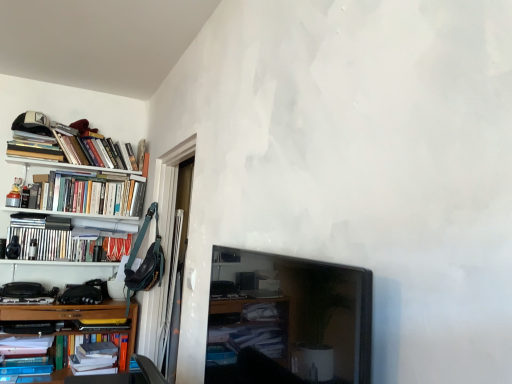
Question: Is hardcover books at left, the first book in the top-to-bottom sequence, situated inside matte black tv at center or outside?

Choices:
 (A) inside
 (B) outside

Answer: (B)

Question: From their relative heights in the image, would you say hardcover books at left, which appears as the seventh book when ordered from the bottom, is taller or shorter than matte black tv at center?

Choices:
 (A) tall
 (B) short

Answer: (B)

Question: Estimate the real-world distances between objects in this image. Which object is closer to the matte black tv at center?

Choices:
 (A) hardcover books at left, which appears as the fourth book when ordered from the bottom
 (B) hardcover book at lower left, acting as the sixth book starting from the top
 (C) hardcover books at left, marked as the 5th book in a top-to-bottom arrangement
 (D) hardcover books at left, the first book in the top-to-bottom sequence
 (E) hardcover books at upper left, the sixth book positioned from the bottom

Answer: (C)

Question: Which object is positioned farthest from the hardcover books at left, which is the fourth book from top to bottom?

Choices:
 (A) matte black tv at center
 (B) hardcover books at upper left, the sixth book positioned from the bottom
 (C) hardcover book at lower left, placed as the 7th book when sorted from top to bottom
 (D) hardcover books at left, which appears as the seventh book when ordered from the bottom
 (E) hardcover books at left, which is counted as the fifth book, starting from the bottom

Answer: (A)